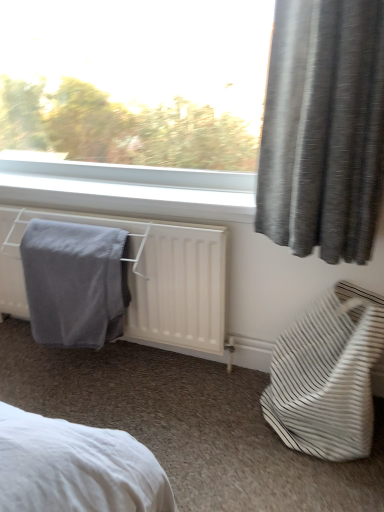
Question: From a real-world perspective, is white striped fabric bag at lower right positioned above or below white matte radiator at lower left?

Choices:
 (A) below
 (B) above

Answer: (A)

Question: In terms of size, does white striped fabric bag at lower right appear bigger or smaller than white matte radiator at lower left?

Choices:
 (A) small
 (B) big

Answer: (A)

Question: Which of these objects is positioned closest to the gray textured curtain at upper right?

Choices:
 (A) gray soft towel at lower left
 (B) white matte radiator at lower left
 (C) white striped fabric bag at lower right

Answer: (C)

Question: Estimate the real-world distances between objects in this image. Which object is closer to the white matte radiator at lower left?

Choices:
 (A) gray textured curtain at upper right
 (B) white striped fabric bag at lower right
 (C) gray soft towel at lower left

Answer: (C)